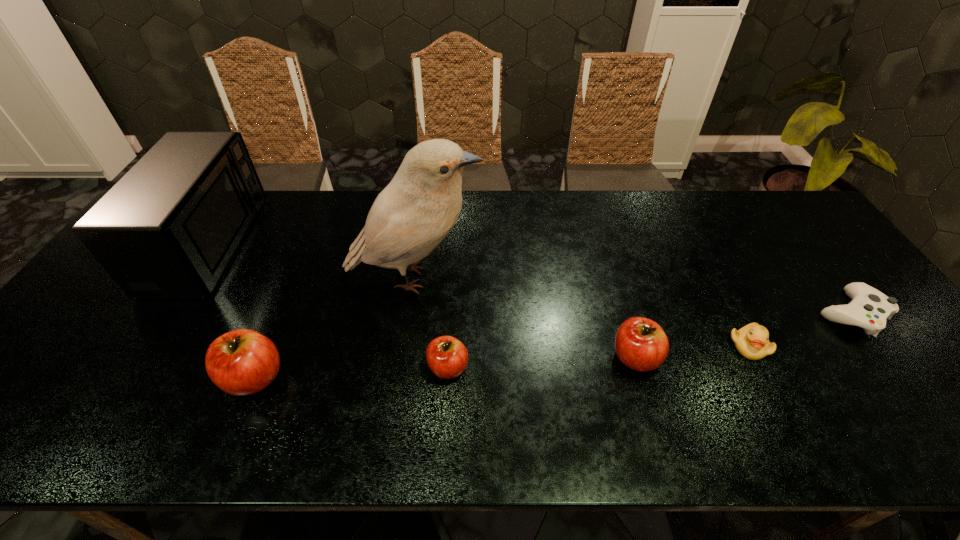
Observe the arrangement of all apples in the image. To keep them evenly spaced, where would you place another apple on the right? Please locate a free space. Please provide its 2D coordinates. Your answer should be formatted as a tuple, i.e. [(x, y)], where the tuple contains the x and y coordinates of a point satisfying the conditions above.

[(816, 348)]